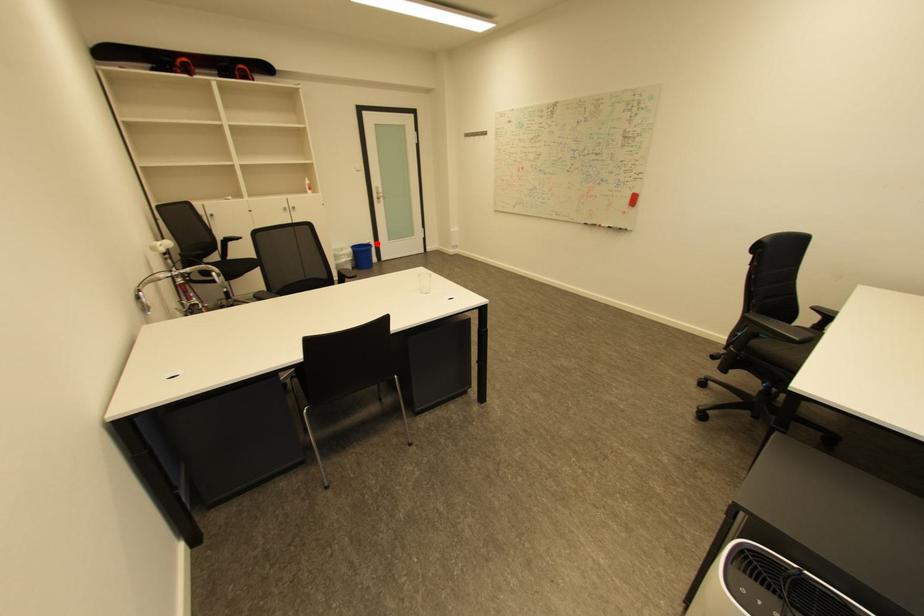
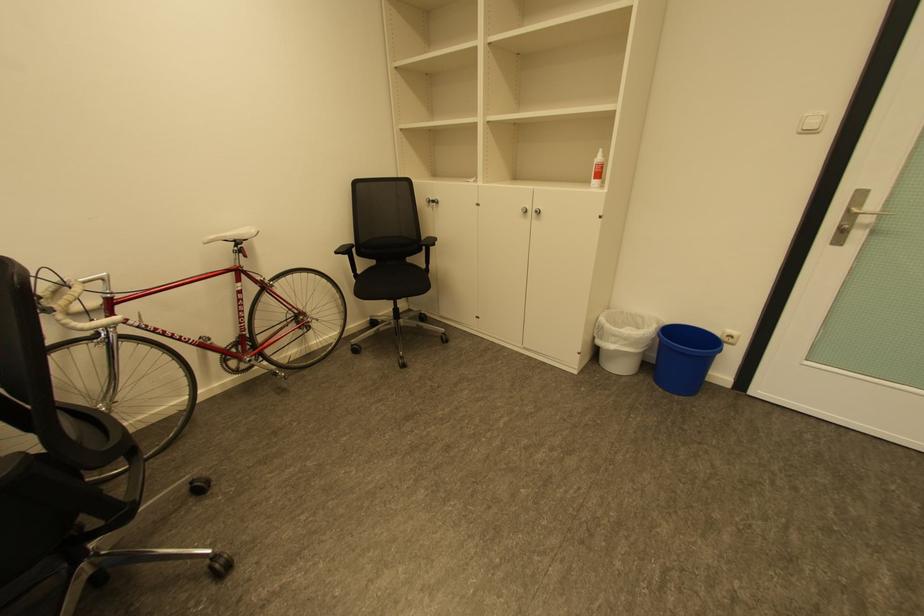
Find the pixel in the second image that matches the highlighted location in the first image.

(737, 337)